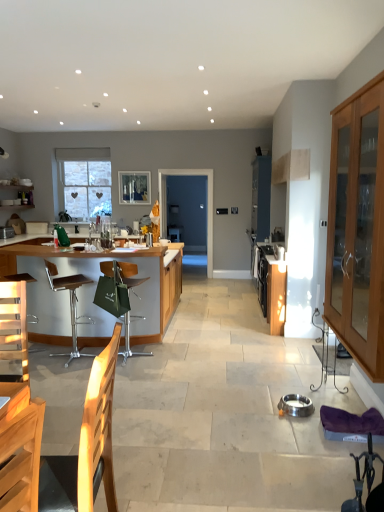
Question: Could you tell me if clear glass window screen at upper center is turned towards transparent glass door at center?

Choices:
 (A) no
 (B) yes

Answer: (A)

Question: Is clear glass window screen at upper center to the left of transparent glass door at center from the viewer's perspective?

Choices:
 (A) yes
 (B) no

Answer: (A)

Question: Is clear glass window screen at upper center in contact with transparent glass door at center?

Choices:
 (A) yes
 (B) no

Answer: (B)

Question: From the image's perspective, is clear glass window screen at upper center located beneath transparent glass door at center?

Choices:
 (A) yes
 (B) no

Answer: (B)

Question: Is clear glass window screen at upper center located outside transparent glass door at center?

Choices:
 (A) no
 (B) yes

Answer: (B)

Question: Based on their positions, is clear glass window screen at upper center located to the left or right of green fabric chair at center, the second chair positioned from the left?

Choices:
 (A) right
 (B) left

Answer: (B)

Question: From the image's perspective, relative to green fabric chair at center, which is the 1th chair from right to left, is clear glass window screen at upper center above or below?

Choices:
 (A) above
 (B) below

Answer: (A)

Question: Considering the positions of clear glass window screen at upper center and green fabric chair at center, the second chair positioned from the left, in the image, is clear glass window screen at upper center wider or thinner than green fabric chair at center, the second chair positioned from the left,?

Choices:
 (A) thin
 (B) wide

Answer: (A)

Question: From a real-world perspective, is clear glass window screen at upper center physically located above or below green fabric chair at center, the second chair positioned from the left?

Choices:
 (A) above
 (B) below

Answer: (A)

Question: Is point (382, 159) positioned closer to the camera than point (69, 201)?

Choices:
 (A) closer
 (B) farther

Answer: (A)

Question: From the image's perspective, relative to clear glass window at upper left, is light brown wooden cabinet at right, the first cabinetry from the right, above or below?

Choices:
 (A) above
 (B) below

Answer: (B)

Question: Do you think light brown wooden cabinet at right, marked as the 3th cabinetry in a left-to-right arrangement, is within clear glass window at upper left, or outside of it?

Choices:
 (A) inside
 (B) outside

Answer: (B)

Question: Is light brown wooden cabinet at right, marked as the 3th cabinetry in a left-to-right arrangement, taller or shorter than clear glass window at upper left?

Choices:
 (A) short
 (B) tall

Answer: (B)

Question: Visually, is brown leather bar stool at left, which appears as the 1th chair when viewed from the left, positioned to the left or to the right of clear glass window screen at upper center?

Choices:
 (A) right
 (B) left

Answer: (B)

Question: From the image's perspective, relative to clear glass window screen at upper center, is brown leather bar stool at left, which appears as the 1th chair when viewed from the left, above or below?

Choices:
 (A) above
 (B) below

Answer: (B)